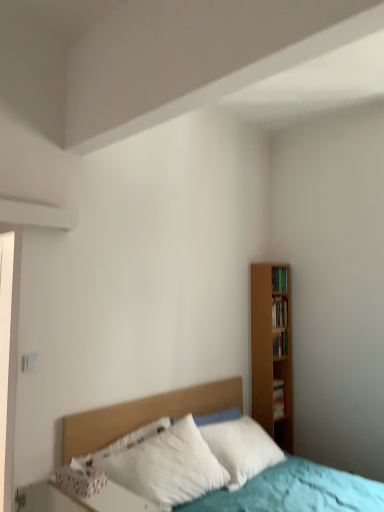
Find the location of a particular element. wooden headboard at center is located at coordinates (x=145, y=414).

Describe the element at coordinates (280, 344) in the screenshot. I see `wooden bookshelf at right, placed as the second book when sorted from bottom to top` at that location.

Locate an element on the screen. wooden bookshelf at right, marked as the second book in a top-to-bottom arrangement is located at coordinates (279, 312).

I want to click on book that is the 1st object above the wooden headboard at center (from a real-world perspective), so click(x=278, y=398).

Is point (273, 396) farther from camera compared to point (113, 438)?

Yes, it is.

In the image, is hardcover book at right, the first book in the bottom-to-top sequence, positioned in front of or behind wooden headboard at center?

Visually, hardcover book at right, the first book in the bottom-to-top sequence, is located behind wooden headboard at center.

Does hardcover book at right, the first book in the bottom-to-top sequence, have a lesser width compared to wooden headboard at center?

Indeed, hardcover book at right, the first book in the bottom-to-top sequence, has a lesser width compared to wooden headboard at center.

Is point (277, 326) closer to camera compared to point (282, 288)?

Yes, it is.

Can you confirm if wooden bookshelf at right, marked as the 3th book in a bottom-to-top arrangement, is positioned to the left of wooden bookshelf at right, which is the 4th book in bottom-to-top order?

Yes.

Identify the location of the 1st book to the right of the wooden bookshelf at right, marked as the second book in a top-to-bottom arrangement, counting from the anchor's position. (279, 279).

Is wooden bookshelf at right, marked as the 3th book in a bottom-to-top arrangement, further to the viewer compared to wooden bookshelf at right, which is the 4th book in bottom-to-top order?

No, wooden bookshelf at right, marked as the 3th book in a bottom-to-top arrangement, is closer to the viewer.

Does point (275, 278) lie in front of point (283, 348)?

Yes, point (275, 278) is in front of point (283, 348).

Is the position of wooden bookshelf at right, the 1th book when ordered from top to bottom, more distant than that of wooden bookshelf at right, which is counted as the 3th book, starting from the top?

Yes, it is.

How far apart are wooden bookshelf at right, the 1th book when ordered from top to bottom, and wooden bookshelf at right, which is counted as the 3th book, starting from the top?

wooden bookshelf at right, the 1th book when ordered from top to bottom, is 18.23 inches away from wooden bookshelf at right, which is counted as the 3th book, starting from the top.

From a real-world perspective, relative to wooden bookshelf at right, which is counted as the 3th book, starting from the top, is wooden bookshelf at right, which is the 4th book in bottom-to-top order, vertically above or below?

wooden bookshelf at right, which is the 4th book in bottom-to-top order, is situated higher than wooden bookshelf at right, which is counted as the 3th book, starting from the top, in the real world.

From a real-world perspective, is wooden bookshelf at right, the 1th book when ordered from top to bottom, under wooden headboard at center?

No, from a real-world perspective, wooden bookshelf at right, the 1th book when ordered from top to bottom, is not below wooden headboard at center.

Is wooden bookshelf at right, which is the 4th book in bottom-to-top order, facing away from wooden headboard at center?

No, wooden bookshelf at right, which is the 4th book in bottom-to-top order, is not facing the opposite direction of wooden headboard at center.

In terms of height, does wooden bookshelf at right, the 1th book when ordered from top to bottom, look taller or shorter compared to wooden headboard at center?

In the image, wooden bookshelf at right, the 1th book when ordered from top to bottom, appears to be shorter than wooden headboard at center.

Locate an element on the screen. This screenshot has height=512, width=384. headboard below the wooden bookshelf at right, which is the 4th book in bottom-to-top order (from a real-world perspective) is located at coordinates (145, 414).

Is wooden bookshelf at right, marked as the 3th book in a bottom-to-top arrangement, beside wooden headboard at center?

No, wooden bookshelf at right, marked as the 3th book in a bottom-to-top arrangement, is not beside wooden headboard at center.

From a real-world perspective, does wooden bookshelf at right, marked as the second book in a top-to-bottom arrangement, sit lower than wooden headboard at center?

No, from a real-world perspective, wooden bookshelf at right, marked as the second book in a top-to-bottom arrangement, is not under wooden headboard at center.

Is wooden bookshelf at right, marked as the 3th book in a bottom-to-top arrangement, to the left of wooden headboard at center from the viewer's perspective?

No.

At what (x,y) coordinates should I click in order to perform the action: click on the 2nd book located above the hardcover book at right, the 4th book from the top (from a real-world perspective). Please return your answer as a coordinate pair (x, y). This screenshot has width=384, height=512. Looking at the image, I should click on (279, 312).

Looking at their sizes, would you say hardcover book at right, the first book in the bottom-to-top sequence, is wider or thinner than wooden bookshelf at right, marked as the 3th book in a bottom-to-top arrangement?

In the image, hardcover book at right, the first book in the bottom-to-top sequence, appears to be wider than wooden bookshelf at right, marked as the 3th book in a bottom-to-top arrangement.

Is point (274, 380) positioned before point (276, 310)?

Yes, point (274, 380) is in front of point (276, 310).

Between hardcover book at right, the first book in the bottom-to-top sequence, and wooden bookshelf at right, marked as the second book in a top-to-bottom arrangement, which one has larger size?

wooden bookshelf at right, marked as the second book in a top-to-bottom arrangement, is bigger.

Can you confirm if wooden headboard at center is positioned to the right of wooden bookshelf at right, which is counted as the 3th book, starting from the top?

No, wooden headboard at center is not to the right of wooden bookshelf at right, which is counted as the 3th book, starting from the top.

Who is shorter, wooden headboard at center or wooden bookshelf at right, placed as the second book when sorted from bottom to top?

wooden bookshelf at right, placed as the second book when sorted from bottom to top, is shorter.

Considering the relative positions of wooden headboard at center and wooden bookshelf at right, placed as the second book when sorted from bottom to top, in the image provided, is wooden headboard at center behind wooden bookshelf at right, placed as the second book when sorted from bottom to top,?

No, it is in front of wooden bookshelf at right, placed as the second book when sorted from bottom to top.

Does wooden headboard at center have a lesser width compared to wooden bookshelf at right, which is counted as the 3th book, starting from the top?

Incorrect, the width of wooden headboard at center is not less than that of wooden bookshelf at right, which is counted as the 3th book, starting from the top.

Identify the location of headboard located on the left of hardcover book at right, the 4th book from the top. click(x=145, y=414).

From the wooden bookshelf at right, which is the 4th book in bottom-to-top order, count 1st books forward and point to it. Please provide its 2D coordinates.

[(279, 312)]

From the image, which object appears to be nearer to hardcover book at right, the 4th book from the top, wooden headboard at center or wooden bookshelf at right, the 1th book when ordered from top to bottom?

wooden bookshelf at right, the 1th book when ordered from top to bottom, is closer to hardcover book at right, the 4th book from the top.

Looking at the image, which one is located further to hardcover book at right, the 4th book from the top, wooden bookshelf at right, the 1th book when ordered from top to bottom, or wooden bookshelf at right, which is counted as the 3th book, starting from the top?

wooden bookshelf at right, the 1th book when ordered from top to bottom.

Based on their spatial positions, is wooden bookshelf at right, which is the 4th book in bottom-to-top order, or hardcover book at right, the 4th book from the top, closer to wooden bookshelf at right, which is counted as the 3th book, starting from the top?

hardcover book at right, the 4th book from the top, is positioned closer to the anchor wooden bookshelf at right, which is counted as the 3th book, starting from the top.

Based on their spatial positions, is hardcover book at right, the first book in the bottom-to-top sequence, or wooden bookshelf at right, placed as the second book when sorted from bottom to top, further from wooden headboard at center?

Based on the image, wooden bookshelf at right, placed as the second book when sorted from bottom to top, appears to be further to wooden headboard at center.

Based on their spatial positions, is wooden headboard at center or hardcover book at right, the 4th book from the top, further from wooden bookshelf at right, which is the 4th book in bottom-to-top order?

wooden headboard at center is positioned further to the anchor wooden bookshelf at right, which is the 4th book in bottom-to-top order.

From the image, which object appears to be nearer to wooden bookshelf at right, which is the 4th book in bottom-to-top order, wooden headboard at center or wooden bookshelf at right, marked as the 3th book in a bottom-to-top arrangement?

Among the two, wooden bookshelf at right, marked as the 3th book in a bottom-to-top arrangement, is located nearer to wooden bookshelf at right, which is the 4th book in bottom-to-top order.

Based on their spatial positions, is wooden bookshelf at right, marked as the 3th book in a bottom-to-top arrangement, or wooden bookshelf at right, which is counted as the 3th book, starting from the top, closer to hardcover book at right, the 4th book from the top?

wooden bookshelf at right, which is counted as the 3th book, starting from the top, is closer to hardcover book at right, the 4th book from the top.

Estimate the real-world distances between objects in this image. Which object is closer to wooden bookshelf at right, which is counted as the 3th book, starting from the top, wooden headboard at center or wooden bookshelf at right, marked as the 3th book in a bottom-to-top arrangement?

wooden bookshelf at right, marked as the 3th book in a bottom-to-top arrangement, lies closer to wooden bookshelf at right, which is counted as the 3th book, starting from the top, than the other object.

Where is `book between wooden bookshelf at right, marked as the 3th book in a bottom-to-top arrangement, and hardcover book at right, the first book in the bottom-to-top sequence, in the vertical direction`? This screenshot has height=512, width=384. book between wooden bookshelf at right, marked as the 3th book in a bottom-to-top arrangement, and hardcover book at right, the first book in the bottom-to-top sequence, in the vertical direction is located at coordinates (280, 344).

Locate an element on the screen. This screenshot has width=384, height=512. book between wooden bookshelf at right, which is the 4th book in bottom-to-top order, and wooden bookshelf at right, which is counted as the 3th book, starting from the top, in the vertical direction is located at coordinates (279, 312).

Locate an element on the screen. Image resolution: width=384 pixels, height=512 pixels. book positioned between wooden headboard at center and wooden bookshelf at right, marked as the second book in a top-to-bottom arrangement, from near to far is located at coordinates (280, 344).